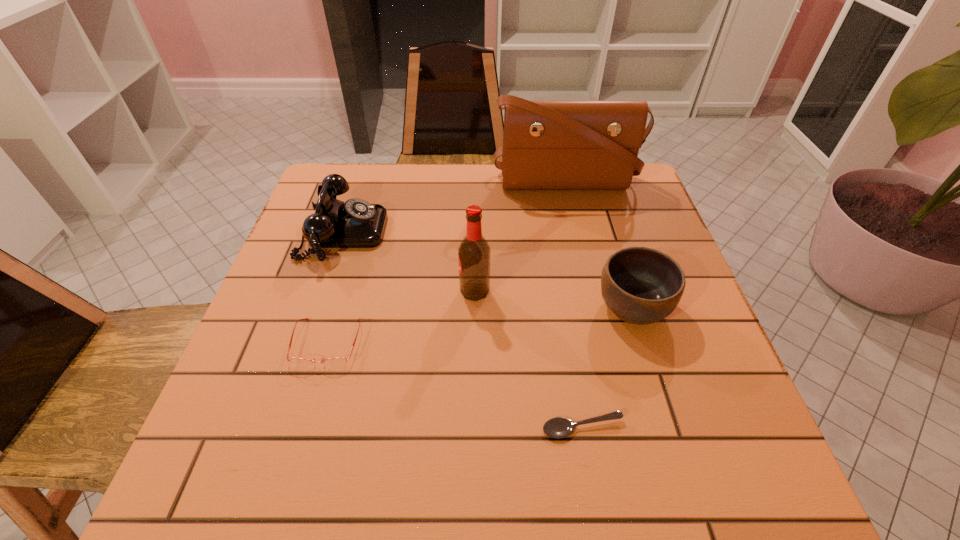
You are a GUI agent. You are given a task and a screenshot of the screen. Output one action in this format:
    pyautogui.click(x=<x>, y=<y>)
    Task: Click on the empty location between the shortest object and the fifth tallest object
    
    Given the screenshot: What is the action you would take?
    pyautogui.click(x=455, y=385)

Find the location of a particular element. The width and height of the screenshot is (960, 540). unoccupied position between the beer bottle and the second farthest object is located at coordinates (409, 261).

Find the location of a particular element. This screenshot has height=540, width=960. vacant space that is in between the beer bottle and the second farthest object is located at coordinates (409, 261).

Find the location of a particular element. The width and height of the screenshot is (960, 540). vacant area that lies between the farthest object and the bowl is located at coordinates (598, 246).

I want to click on free area in between the beer bottle and the fifth nearest object, so click(x=409, y=261).

Where is `free space between the farthest object and the soupspoon`? The height and width of the screenshot is (540, 960). free space between the farthest object and the soupspoon is located at coordinates (574, 306).

What are the coordinates of `empty location between the second shortest object and the telephone` in the screenshot? It's located at (335, 287).

This screenshot has height=540, width=960. I want to click on empty space that is in between the soupspoon and the second shortest object, so click(x=455, y=385).

At what (x,y) coordinates should I click in order to perform the action: click on unoccupied position between the spectacles and the third object from left to right. Please return your answer as a coordinate pair (x, y). The image size is (960, 540). Looking at the image, I should click on (400, 316).

This screenshot has height=540, width=960. Identify the location of free space between the third object from left to right and the shortest object. (529, 359).